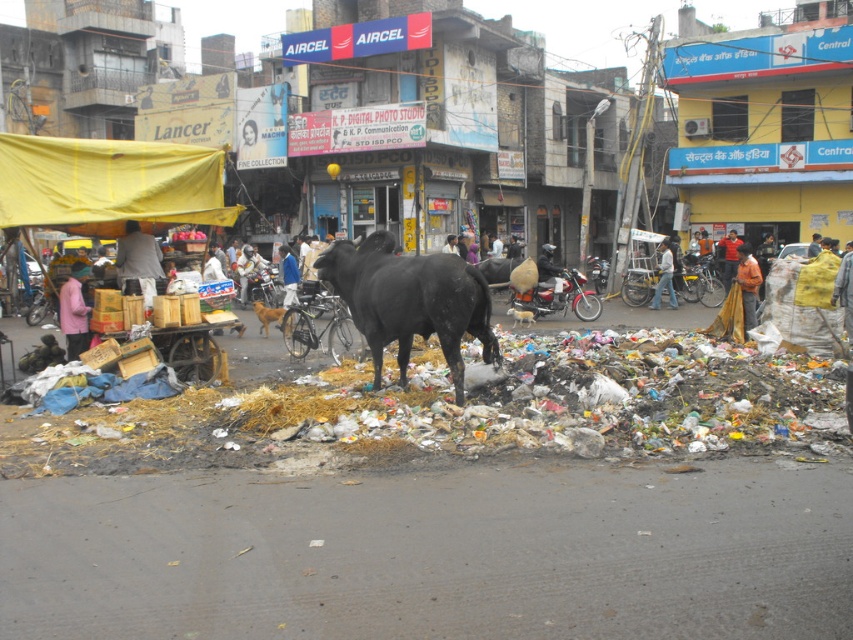
Question: Which of the following is the closest to the observer?

Choices:
 (A) (354, 314)
 (B) (743, 365)
 (C) (554, 273)

Answer: (B)

Question: Is black matte bull at center above light brown fabric bag at left?

Choices:
 (A) no
 (B) yes

Answer: (A)

Question: In this image, where is black matte bull at center located relative to brown fur dog at center?

Choices:
 (A) left
 (B) right

Answer: (B)

Question: Which point is farther from the camera taking this photo?

Choices:
 (A) [x=670, y=307]
 (B) [x=746, y=310]
 (C) [x=729, y=243]
 (D) [x=254, y=147]

Answer: (D)

Question: Where is pink fabric at lower left located in relation to orange fabric at right in the image?

Choices:
 (A) left
 (B) right

Answer: (A)

Question: Estimate the real-world distances between objects in this image. Which object is closer to the black matte bull at center?

Choices:
 (A) jeans at center
 (B) dark brown leather jacket at center

Answer: (B)